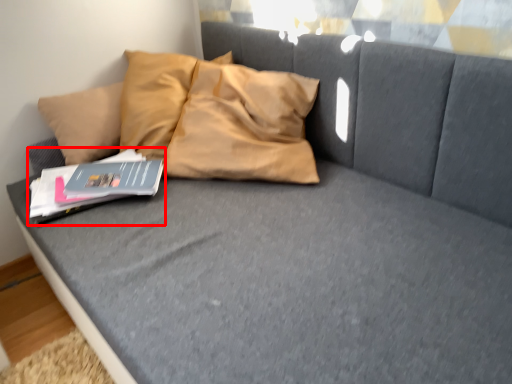
Question: Considering the relative positions of paperback book (annotated by the red box) and paperback book in the image provided, where is paperback book (annotated by the red box) located with respect to the staircase?

Choices:
 (A) right
 (B) left

Answer: (B)